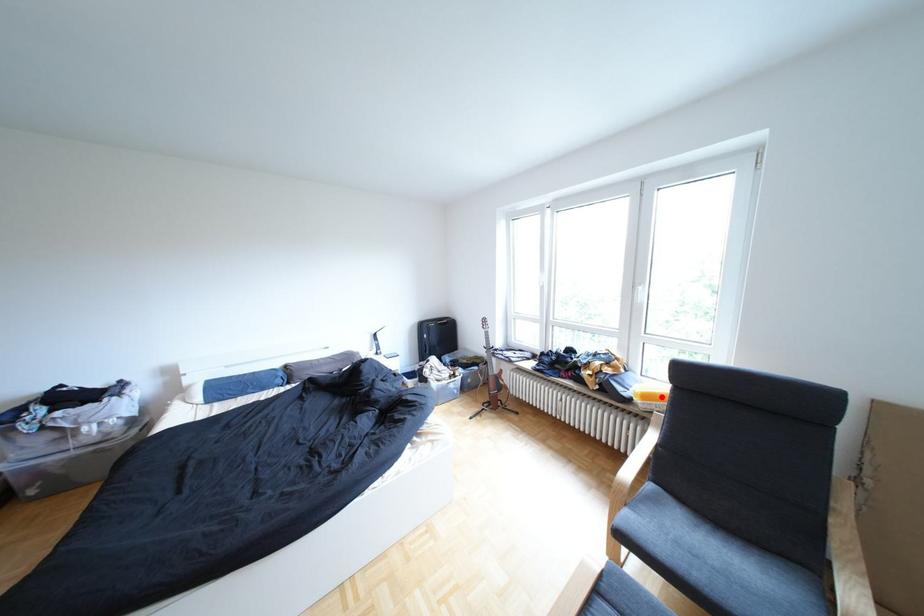
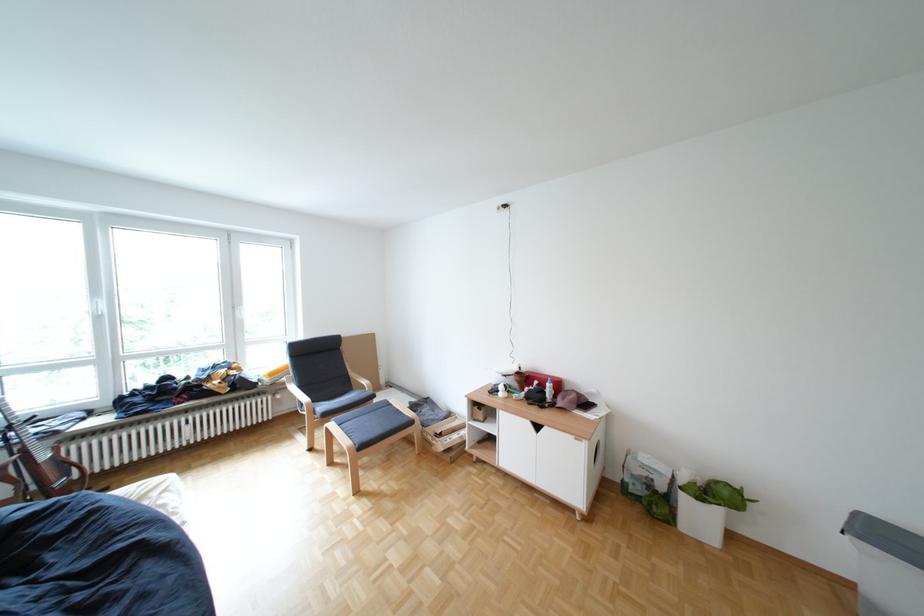
Question: I am providing you with two images of the same scene from different viewpoints. A red point is marked on the first image. Can you still see the location of the red point in image 2?

Choices:
 (A) Yes
 (B) No

Answer: (A)